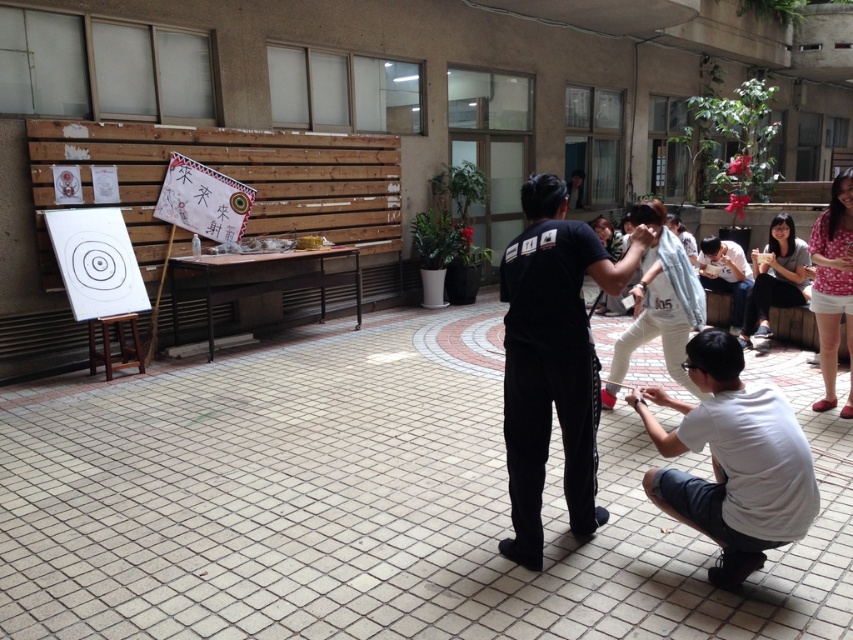
Question: Among these points, which one is farthest from the camera?

Choices:
 (A) (585, 461)
 (B) (746, 522)
 (C) (704, 241)

Answer: (C)

Question: Is black matte shirt at center thinner than white matte shirt at lower right?

Choices:
 (A) yes
 (B) no

Answer: (B)

Question: Which of the following is the closest to the observer?

Choices:
 (A) (552, 193)
 (B) (746, 294)

Answer: (A)

Question: Among these objects, which one is nearest to the camera?

Choices:
 (A) black matte shirt at center
 (B) white cotton shirt at lower right

Answer: (A)

Question: Does black matte shirt at center have a lesser width compared to white matte shirt at lower right?

Choices:
 (A) yes
 (B) no

Answer: (B)

Question: Is white matte shirt at lower right thinner than white cotton shirt at lower right?

Choices:
 (A) no
 (B) yes

Answer: (B)